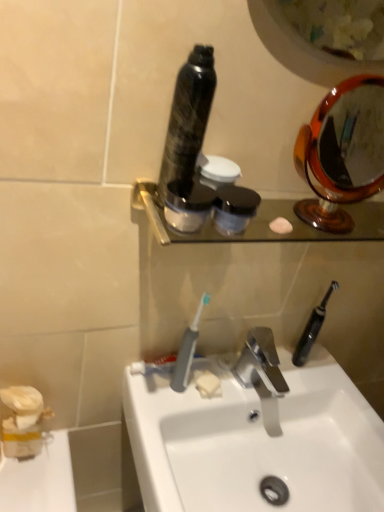
Where is `free location to the left of white matte soap at center`? free location to the left of white matte soap at center is located at coordinates (165, 390).